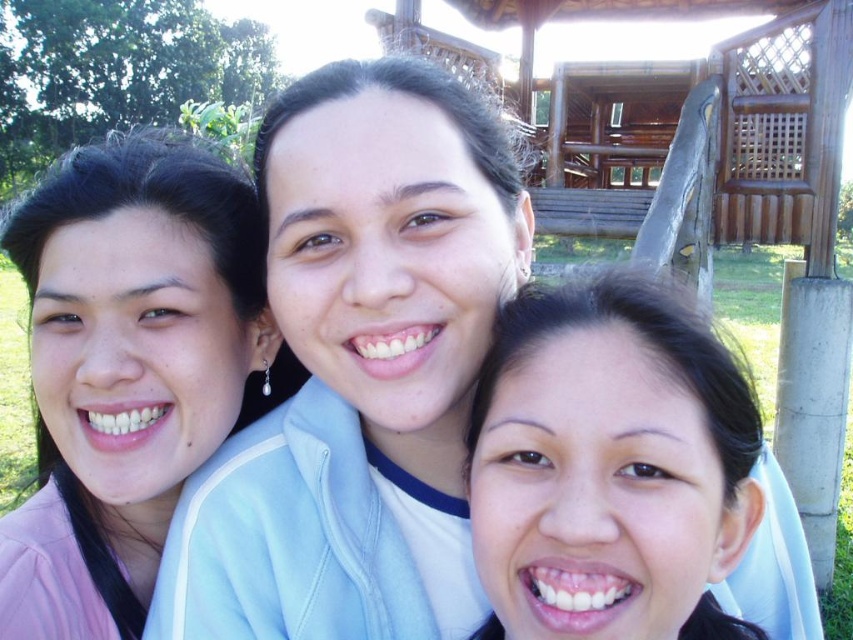
You are a photographer trying to capture a group photo of the matte pink jacket at left and the smooth skin face at center. Since you want to ensure both are in focus, you need to know their distance apart. Can you tell me how far apart they are?

The matte pink jacket at left is positioned to the left of the smooth skin face at center, but the exact distance between them isn not specified in the provided description. Without specific measurements, I cannot determine their separation.